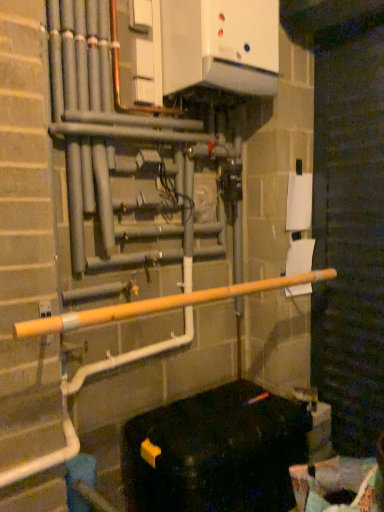
Question: Considering their positions, is black plastic container at lower right located in front of or behind recycled cardboard box at lower right?

Choices:
 (A) front
 (B) behind

Answer: (B)

Question: Is point (264, 480) closer or farther from the camera than point (364, 476)?

Choices:
 (A) farther
 (B) closer

Answer: (A)

Question: Based on their relative distances, which object is nearer to the recycled cardboard box at lower right?

Choices:
 (A) yellow matte pipe at center
 (B) black plastic container at lower right

Answer: (B)

Question: Considering the real-world distances, which object is closest to the yellow matte pipe at center?

Choices:
 (A) black plastic container at lower right
 (B) recycled cardboard box at lower right

Answer: (A)